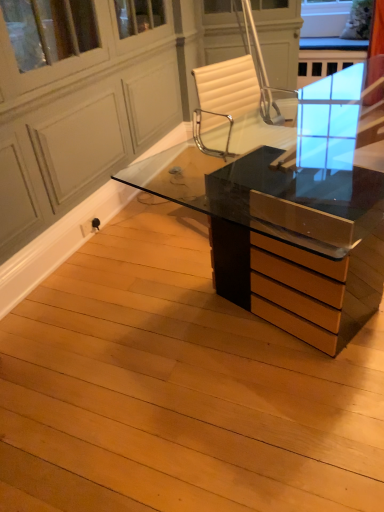
Question: Is matte black desk at center bigger or smaller than transparent glass screen door at upper center?

Choices:
 (A) small
 (B) big

Answer: (A)

Question: From the image's perspective, is matte black desk at center positioned above or below transparent glass screen door at upper center?

Choices:
 (A) above
 (B) below

Answer: (B)

Question: Based on their positions, is matte black desk at center located to the left or right of transparent glass screen door at upper center?

Choices:
 (A) left
 (B) right

Answer: (B)

Question: Is transparent glass screen door at upper center bigger or smaller than matte black desk at center?

Choices:
 (A) big
 (B) small

Answer: (A)

Question: In the image, is transparent glass screen door at upper center positioned in front of or behind matte black desk at center?

Choices:
 (A) front
 (B) behind

Answer: (A)

Question: Considering the positions of transparent glass screen door at upper center and matte black desk at center in the image, is transparent glass screen door at upper center wider or thinner than matte black desk at center?

Choices:
 (A) wide
 (B) thin

Answer: (B)

Question: Considering the positions of point (3, 15) and point (294, 266), is point (3, 15) closer or farther from the camera than point (294, 266)?

Choices:
 (A) farther
 (B) closer

Answer: (A)